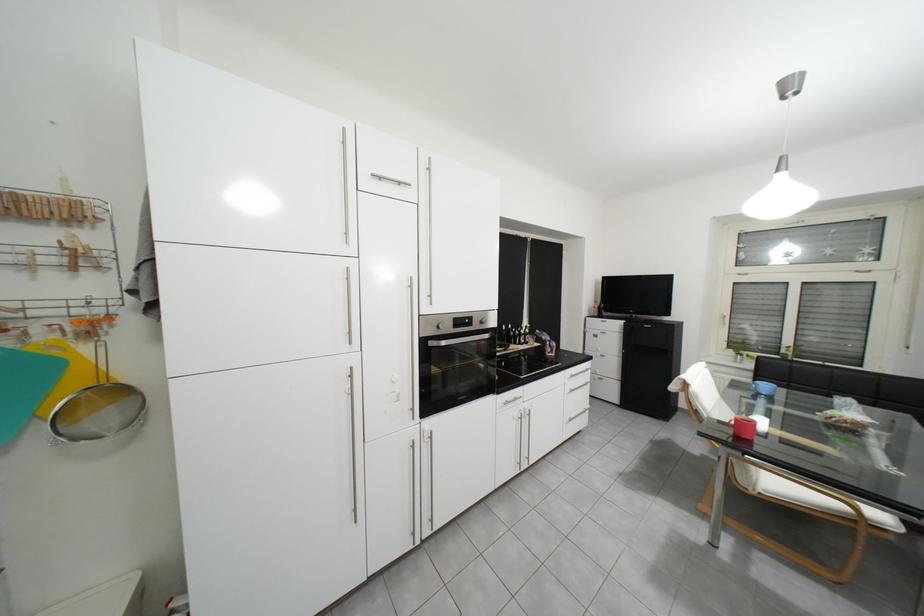
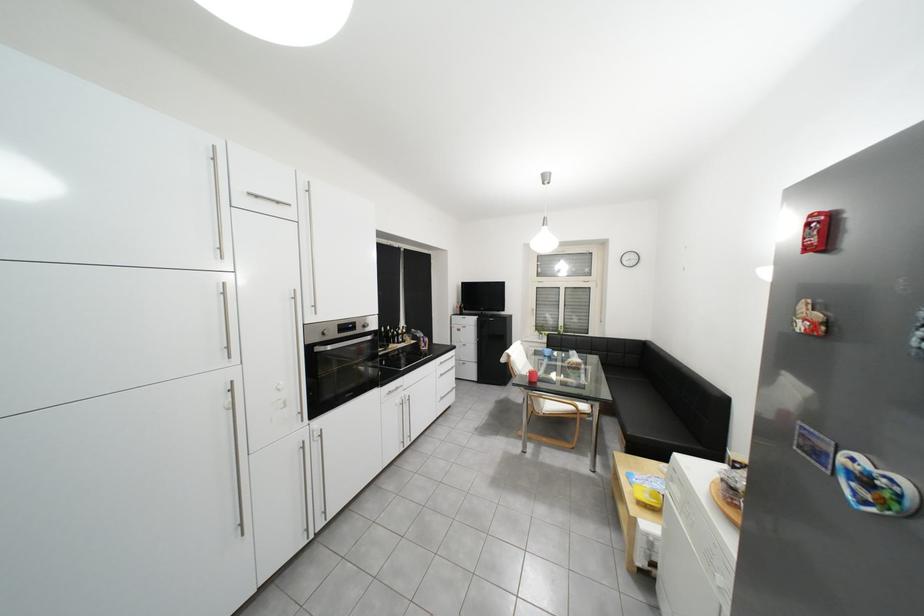
Locate, in the second image, the point that corresponds to (450,329) in the first image.

(334, 334)